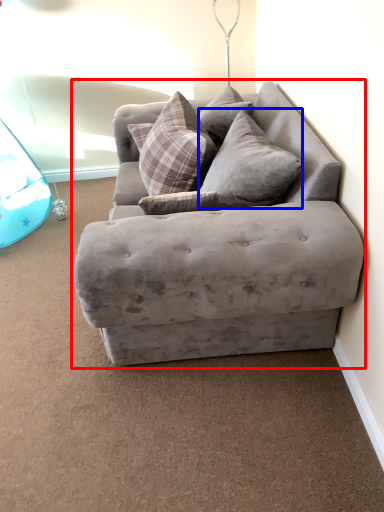
Question: Which object appears closest to the camera in this image, studio couch (highlighted by a red box) or pillow (highlighted by a blue box)?

Choices:
 (A) studio couch
 (B) pillow

Answer: (A)